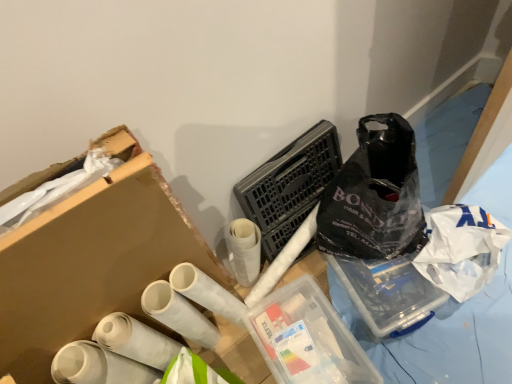
Question: Can you confirm if white matte toilet paper at lower left, which appears as the second toilet paper when viewed from the right, is bigger than transparent plastic container at center?

Choices:
 (A) no
 (B) yes

Answer: (A)

Question: From a real-world perspective, is white matte toilet paper at lower left, the 2th toilet paper from the left, on transparent plastic container at center?

Choices:
 (A) yes
 (B) no

Answer: (A)

Question: Does white matte toilet paper at lower left, which appears as the second toilet paper when viewed from the right, have a greater height compared to transparent plastic container at center?

Choices:
 (A) no
 (B) yes

Answer: (B)

Question: Can you confirm if white matte toilet paper at lower left, the 2th toilet paper from the left, is positioned to the right of transparent plastic container at center?

Choices:
 (A) no
 (B) yes

Answer: (A)

Question: Are white matte toilet paper at lower left, which appears as the second toilet paper when viewed from the right, and transparent plastic container at center located far from each other?

Choices:
 (A) yes
 (B) no

Answer: (B)

Question: Would you say transparent plastic container at center is part of white matte toilet paper at lower left, which appears as the second toilet paper when viewed from the right,'s contents?

Choices:
 (A) yes
 (B) no

Answer: (B)

Question: Does transparent plastic container at center have a greater width compared to white matte toilet paper at lower left, the 3th toilet paper when ordered from right to left?

Choices:
 (A) yes
 (B) no

Answer: (A)

Question: Is transparent plastic container at center smaller than white matte toilet paper at lower left, positioned as the first toilet paper in left-to-right order?

Choices:
 (A) no
 (B) yes

Answer: (A)

Question: Does transparent plastic container at center have a larger size compared to white matte toilet paper at lower left, positioned as the first toilet paper in left-to-right order?

Choices:
 (A) yes
 (B) no

Answer: (A)

Question: Does transparent plastic container at center touch white matte toilet paper at lower left, the 3th toilet paper when ordered from right to left?

Choices:
 (A) yes
 (B) no

Answer: (B)

Question: Is transparent plastic container at center to the left of white matte toilet paper at lower left, positioned as the first toilet paper in left-to-right order, from the viewer's perspective?

Choices:
 (A) yes
 (B) no

Answer: (B)

Question: Is transparent plastic container at center behind white matte toilet paper at lower left, the 3th toilet paper when ordered from right to left?

Choices:
 (A) no
 (B) yes

Answer: (B)

Question: Is transparent plastic container at center facing away from white matte toilet paper at lower left, the 2th toilet paper from the left?

Choices:
 (A) yes
 (B) no

Answer: (B)